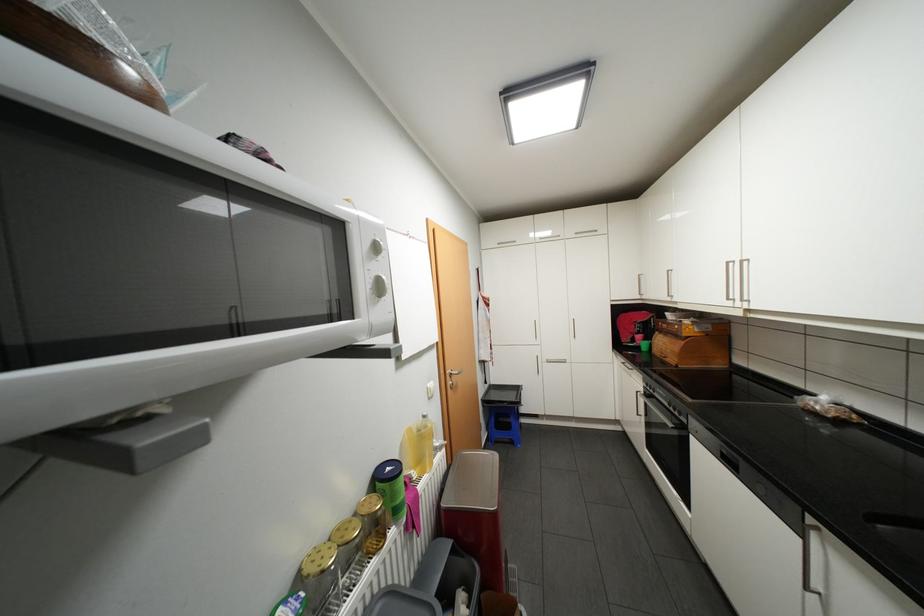
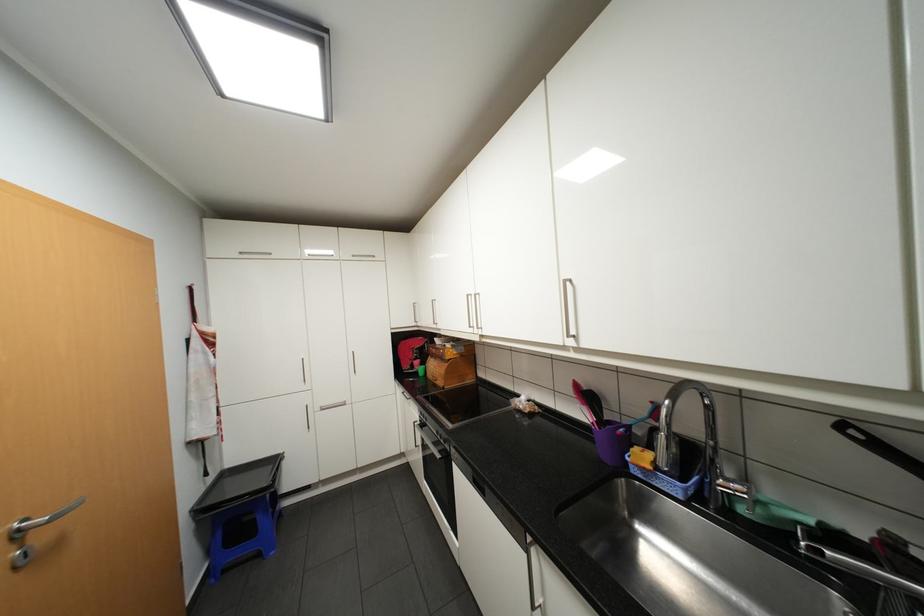
The point at (736, 262) is marked in the first image. Where is the corresponding point in the second image?

(476, 294)